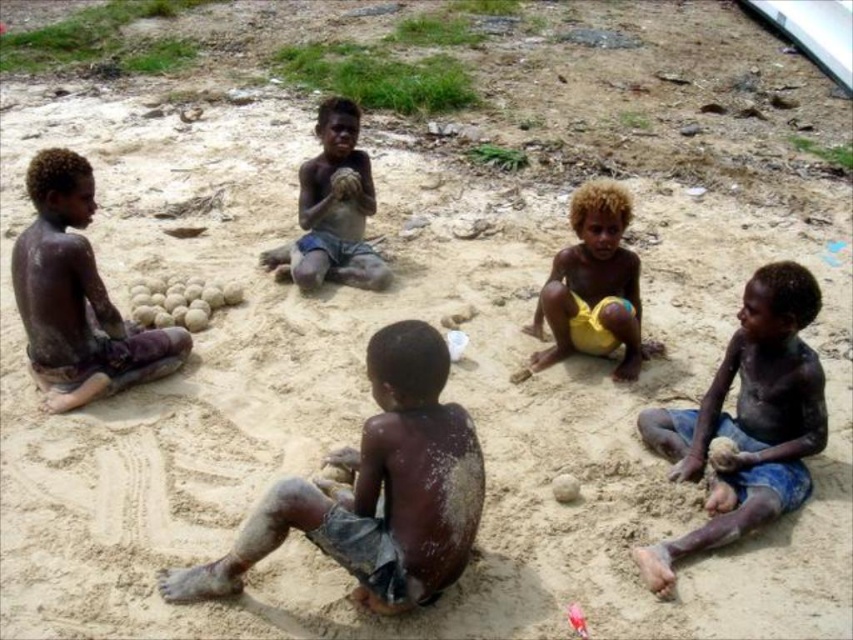
Question: Based on their relative distances, which object is nearer to the brown skin/rough skin child at center?

Choices:
 (A) dark skin boy at left
 (B) dark skin boy at lower right
 (C) brown skin boy at center

Answer: (A)

Question: Can you confirm if brown skin boy at center is positioned below brown skin/rough skin child at center?

Choices:
 (A) yes
 (B) no

Answer: (A)

Question: Can you confirm if dark skin boy at lower right is smaller than dark skin boy at left?

Choices:
 (A) no
 (B) yes

Answer: (A)

Question: Which point is closer to the camera?

Choices:
 (A) natural brown coconuts at center
 (B) brown skin boy at center
 (C) dark skin boy at lower right

Answer: (B)

Question: Which of these objects is positioned closest to the yellow fabric shorts at center?

Choices:
 (A) natural brown coconuts at center
 (B) brown skin boy at center

Answer: (B)

Question: Does dark skin boy at lower right appear under yellow fabric shorts at center?

Choices:
 (A) yes
 (B) no

Answer: (A)